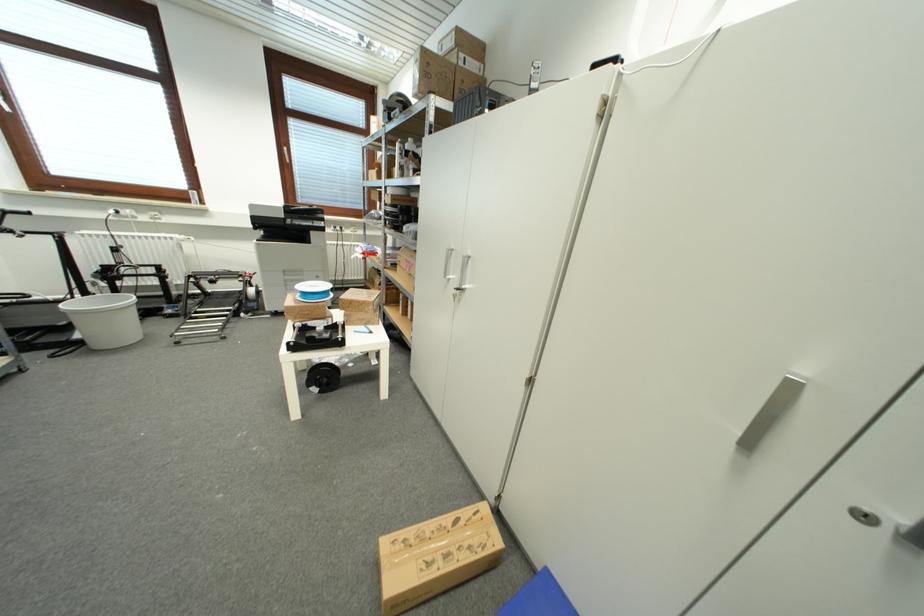
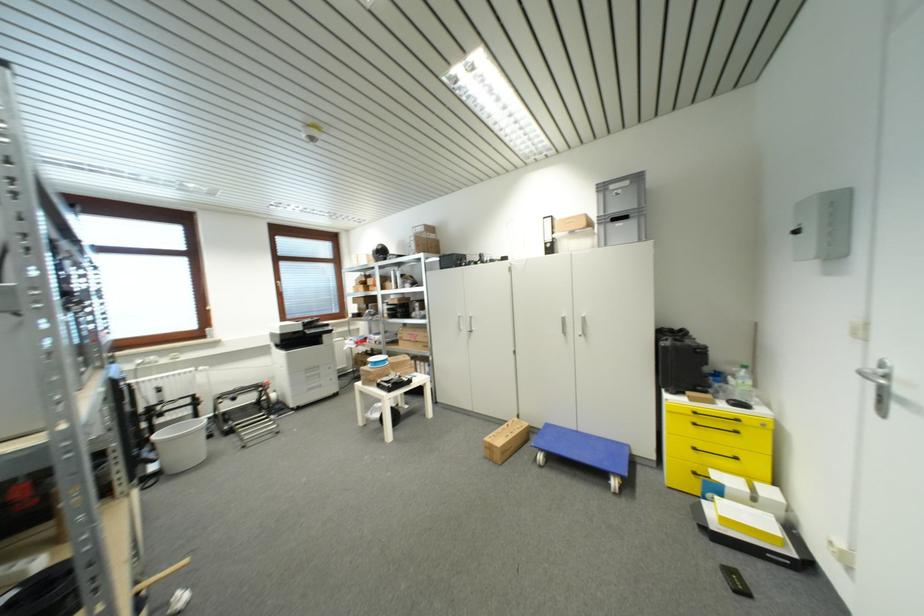
Locate, in the second image, the point that corresponds to the point at 552,575 in the first image.

(552, 427)